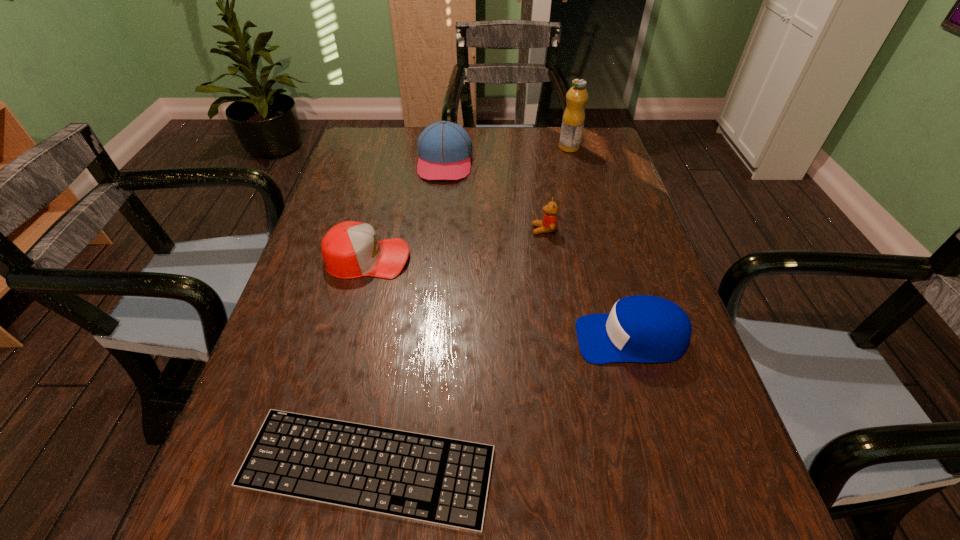
Identify the location of free spot located 0.110m on the right of the shortest object. (564, 467).

Where is `fruit juice positioned at the far edge`? Image resolution: width=960 pixels, height=540 pixels. fruit juice positioned at the far edge is located at coordinates (573, 119).

At what (x,y) coordinates should I click in order to perform the action: click on baseball cap that is positioned at the far edge. Please return your answer as a coordinate pair (x, y). Image resolution: width=960 pixels, height=540 pixels. Looking at the image, I should click on (444, 148).

Where is `object at the near edge`? object at the near edge is located at coordinates (443, 481).

The image size is (960, 540). Find the location of `baseball cap present at the left edge`. baseball cap present at the left edge is located at coordinates (350, 249).

Where is `computer keyboard positioned at the left edge`? Image resolution: width=960 pixels, height=540 pixels. computer keyboard positioned at the left edge is located at coordinates (443, 481).

Identify the location of fruit juice present at the right edge. The width and height of the screenshot is (960, 540). (573, 119).

What are the coordinates of `baseball cap that is at the right edge` in the screenshot? It's located at (645, 329).

You are a GUI agent. You are given a task and a screenshot of the screen. Output one action in this format:
    pyautogui.click(x=<x>, y=<y>)
    Task: Click on the object that is positioned at the near left corner
    This screenshot has height=540, width=960.
    Given the screenshot: What is the action you would take?
    pyautogui.click(x=443, y=481)

At what (x,y) coordinates should I click in order to perform the action: click on object at the far right corner. Please return your answer as a coordinate pair (x, y). Looking at the image, I should click on (573, 119).